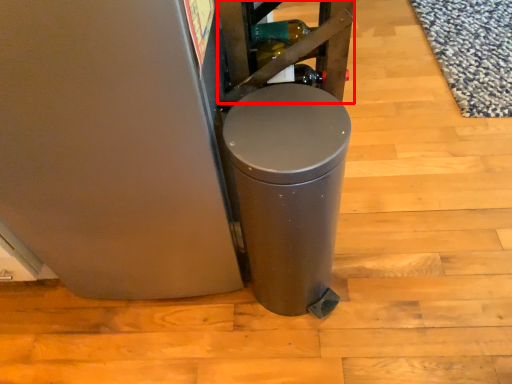
Question: Considering the relative positions of shelf (annotated by the red box) and waste container in the image provided, where is shelf (annotated by the red box) located with respect to the staircase?

Choices:
 (A) left
 (B) right

Answer: (A)